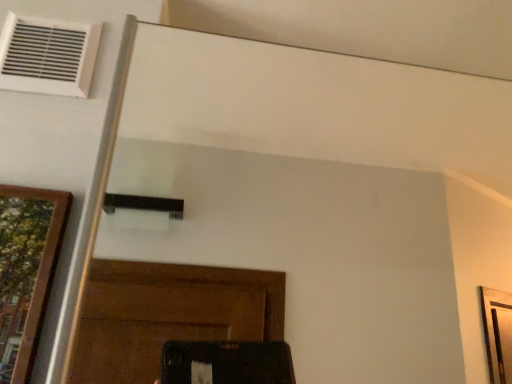
What are the coordinates of `white plastic air conditioner at upper left` in the screenshot? It's located at (48, 55).

Measure the distance between point (17, 84) and camera.

→ 31.26 inches.

This screenshot has height=384, width=512. What do you see at coordinates (48, 55) in the screenshot?
I see `white plastic air conditioner at upper left` at bounding box center [48, 55].

Locate an element on the screen. The height and width of the screenshot is (384, 512). white plastic air conditioner at upper left is located at coordinates (48, 55).